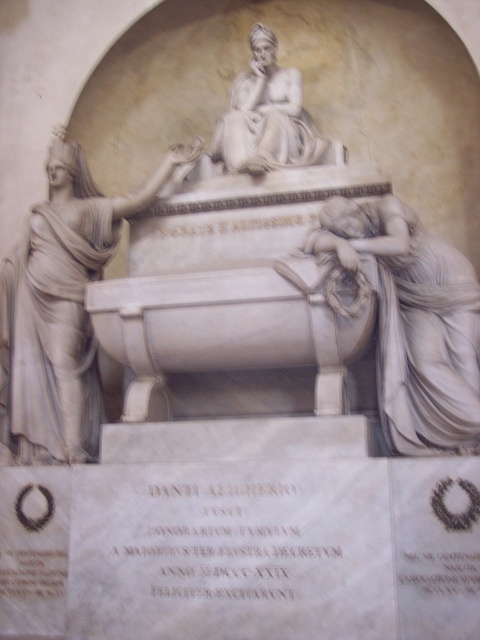
Is white marble sarcophagus at center in front of white marble statue at lower right?

No, white marble sarcophagus at center is behind white marble statue at lower right.

Consider the image. Measure the distance from white marble sarcophagus at center to white marble statue at lower right.

white marble sarcophagus at center is 26.28 feet away from white marble statue at lower right.

Locate an element on the screen. white marble sarcophagus at center is located at coordinates (46, 83).

Which of these two, white marble statue at left or white marble statue at lower right, stands taller?

white marble statue at left

Can you confirm if white marble statue at left is positioned above white marble statue at lower right?

Indeed, white marble statue at left is positioned over white marble statue at lower right.

Locate an element on the screen. This screenshot has height=640, width=480. white marble statue at left is located at coordinates (60, 310).

Identify the location of white marble statue at left. (60, 310).

Between white marble sarcophagus at center and white marble statue at left, which one has less height?

With less height is white marble statue at left.

Who is lower down, white marble sarcophagus at center or white marble statue at left?

white marble statue at left is below.

Where is `white marble sarcophagus at center`? white marble sarcophagus at center is located at coordinates (46, 83).